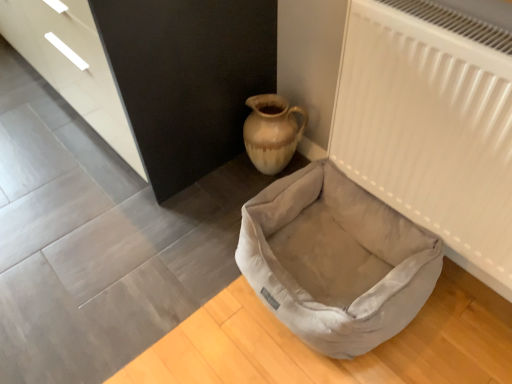
Question: From a real-world perspective, is velvet beige dog bed at lower center on white matte radiator at upper right?

Choices:
 (A) no
 (B) yes

Answer: (A)

Question: Can you confirm if velvet beige dog bed at lower center is smaller than white matte radiator at upper right?

Choices:
 (A) no
 (B) yes

Answer: (A)

Question: Does velvet beige dog bed at lower center turn towards white matte radiator at upper right?

Choices:
 (A) no
 (B) yes

Answer: (A)

Question: Is velvet beige dog bed at lower center shorter than white matte radiator at upper right?

Choices:
 (A) yes
 (B) no

Answer: (A)

Question: Considering the relative sizes of velvet beige dog bed at lower center and white matte radiator at upper right in the image provided, is velvet beige dog bed at lower center wider than white matte radiator at upper right?

Choices:
 (A) yes
 (B) no

Answer: (A)

Question: Considering the relative sizes of velvet beige dog bed at lower center and white matte radiator at upper right in the image provided, is velvet beige dog bed at lower center bigger than white matte radiator at upper right?

Choices:
 (A) yes
 (B) no

Answer: (A)

Question: Is matte black dresser at upper left with matte beige ceramic vase at upper left?

Choices:
 (A) yes
 (B) no

Answer: (B)

Question: From a real-world perspective, is matte black dresser at upper left below matte beige ceramic vase at upper left?

Choices:
 (A) no
 (B) yes

Answer: (A)

Question: Does matte black dresser at upper left have a larger size compared to matte beige ceramic vase at upper left?

Choices:
 (A) no
 (B) yes

Answer: (B)

Question: Is matte black dresser at upper left shorter than matte beige ceramic vase at upper left?

Choices:
 (A) yes
 (B) no

Answer: (B)

Question: Considering the relative sizes of matte black dresser at upper left and matte beige ceramic vase at upper left in the image provided, is matte black dresser at upper left smaller than matte beige ceramic vase at upper left?

Choices:
 (A) no
 (B) yes

Answer: (A)

Question: Could you tell me if matte black dresser at upper left is turned towards matte beige ceramic vase at upper left?

Choices:
 (A) yes
 (B) no

Answer: (B)

Question: Is matte black dresser at upper left a part of white matte radiator at upper right?

Choices:
 (A) no
 (B) yes

Answer: (A)